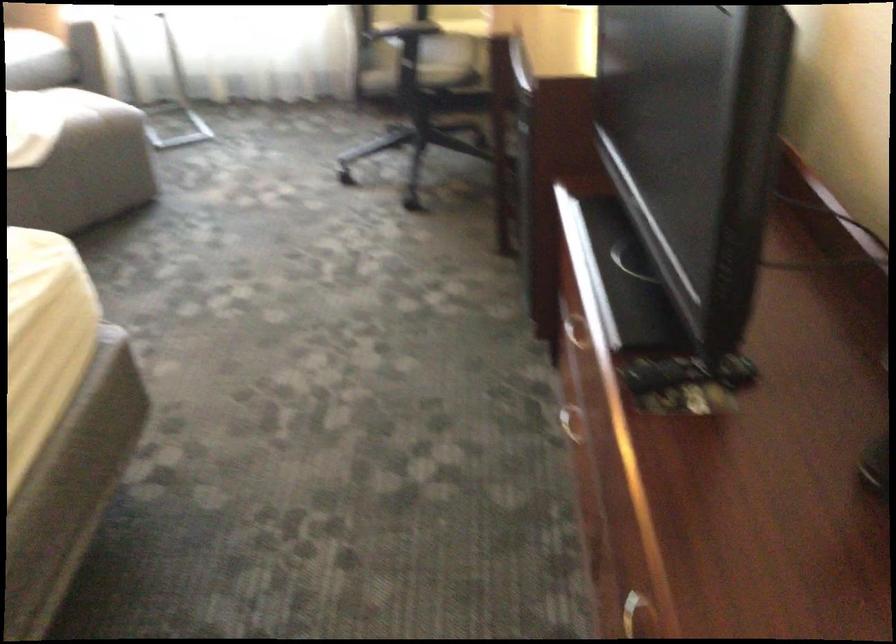
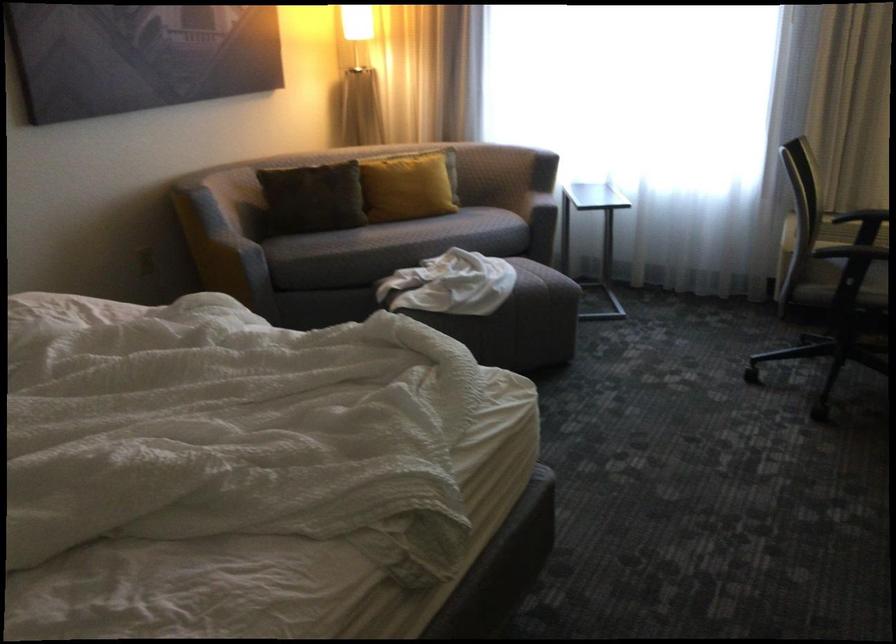
Where in the second image is the point corresponding to (97,143) from the first image?

(538, 301)